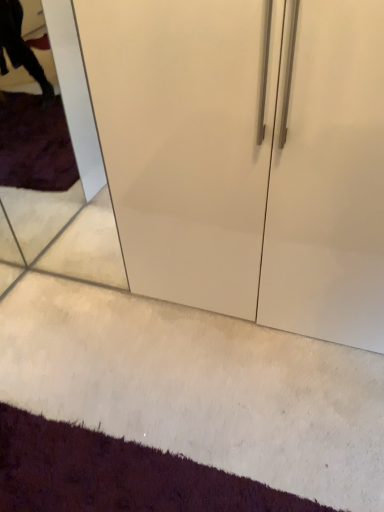
What is the approximate width of dark purple carpet at lower left?

It is 11.23 inches.

Where is `dark purple carpet at lower left`? dark purple carpet at lower left is located at coordinates (116, 475).

The height and width of the screenshot is (512, 384). What do you see at coordinates (116, 475) in the screenshot?
I see `dark purple carpet at lower left` at bounding box center [116, 475].

This screenshot has height=512, width=384. Describe the element at coordinates (44, 143) in the screenshot. I see `transparent glass door at left` at that location.

Where is `transparent glass door at left`? The height and width of the screenshot is (512, 384). transparent glass door at left is located at coordinates (44, 143).

The image size is (384, 512). Identify the location of dark purple carpet at lower left. (116, 475).

Considering the positions of objects transparent glass door at left and dark purple carpet at lower left in the image provided, who is more to the left, transparent glass door at left or dark purple carpet at lower left?

Positioned to the left is transparent glass door at left.

Which is in front, transparent glass door at left or dark purple carpet at lower left?

Positioned in front is dark purple carpet at lower left.

Which point is more distant from viewer, (63, 126) or (59, 476)?

The point (63, 126) is behind.

From the image's perspective, is transparent glass door at left located beneath dark purple carpet at lower left?

Actually, transparent glass door at left appears above dark purple carpet at lower left in the image.

From a real-world perspective, relative to dark purple carpet at lower left, is transparent glass door at left vertically above or below?

Clearly, from a real-world perspective, transparent glass door at left is above dark purple carpet at lower left.

Considering the sizes of objects transparent glass door at left and dark purple carpet at lower left in the image provided, who is wider, transparent glass door at left or dark purple carpet at lower left?

dark purple carpet at lower left is wider.

From their relative heights in the image, would you say transparent glass door at left is taller or shorter than dark purple carpet at lower left?

transparent glass door at left is taller than dark purple carpet at lower left.

Who is bigger, transparent glass door at left or dark purple carpet at lower left?

Bigger between the two is transparent glass door at left.

Can dark purple carpet at lower left be found inside transparent glass door at left?

Actually, dark purple carpet at lower left is outside transparent glass door at left.

Looking at this image, is transparent glass door at left far from dark purple carpet at lower left?

Indeed, transparent glass door at left is not near dark purple carpet at lower left.

Is transparent glass door at left oriented towards dark purple carpet at lower left?

No, transparent glass door at left does not turn towards dark purple carpet at lower left.

How much distance is there between transparent glass door at left and dark purple carpet at lower left?

1.29 meters.

You are a GUI agent. You are given a task and a screenshot of the screen. Output one action in this format:
    pyautogui.click(x=<x>, y=<y>)
    Task: Click on the glass door behind the dark purple carpet at lower left
    The width and height of the screenshot is (384, 512).
    Given the screenshot: What is the action you would take?
    pyautogui.click(x=44, y=143)

Between dark purple carpet at lower left and transparent glass door at left, which one appears on the left side from the viewer's perspective?

transparent glass door at left.

Who is more distant, dark purple carpet at lower left or transparent glass door at left?

transparent glass door at left is further away from the camera.

Which is more distant, (239, 490) or (55, 99)?

The point (55, 99) is farther.

From the image's perspective, which object appears higher, dark purple carpet at lower left or transparent glass door at left?

From the image's view, transparent glass door at left is above.

From a real-world perspective, relative to transparent glass door at left, is dark purple carpet at lower left vertically above or below?

Clearly, from a real-world perspective, dark purple carpet at lower left is below transparent glass door at left.

Does dark purple carpet at lower left have a greater width compared to transparent glass door at left?

Yes.

From the picture: Can you confirm if dark purple carpet at lower left is shorter than transparent glass door at left?

Yes, dark purple carpet at lower left is shorter than transparent glass door at left.

Does dark purple carpet at lower left have a larger size compared to transparent glass door at left?

No, dark purple carpet at lower left is not bigger than transparent glass door at left.

Is dark purple carpet at lower left located outside transparent glass door at left?

Indeed, dark purple carpet at lower left is completely outside transparent glass door at left.

Is dark purple carpet at lower left placed right next to transparent glass door at left?

There is a gap between dark purple carpet at lower left and transparent glass door at left.

Is dark purple carpet at lower left aimed at transparent glass door at left?

No.

The height and width of the screenshot is (512, 384). What are the coordinates of `glass door above the dark purple carpet at lower left (from a real-world perspective)` in the screenshot? It's located at (44, 143).

At what (x,y) coordinates should I click in order to perform the action: click on glass door behind the dark purple carpet at lower left. Please return your answer as a coordinate pair (x, y). The height and width of the screenshot is (512, 384). Looking at the image, I should click on (44, 143).

Where is `doormat lying below the transparent glass door at left (from the image's perspective)`? Image resolution: width=384 pixels, height=512 pixels. doormat lying below the transparent glass door at left (from the image's perspective) is located at coordinates pyautogui.click(x=116, y=475).